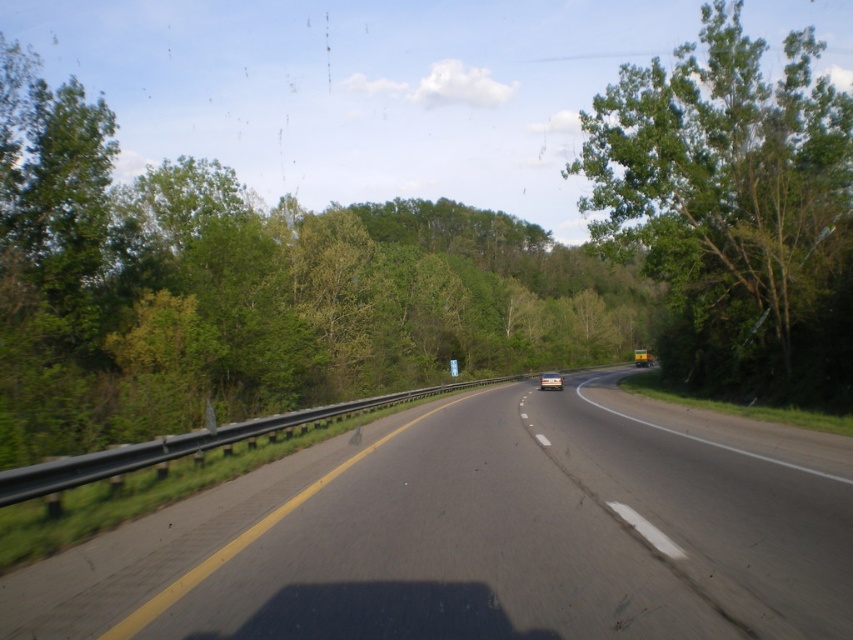
You are driving a car with a width of 2 meters. You see the green leafy tree at right. Can you safely drive through the road without hitting the tree?

The green leafy tree at right is located at point (733, 209). Since the tree is positioned at the right side of the road and the road has a width accommodating two lanes, the car can safely drive through the road without hitting the tree as long as it stays within its lane.

You are driving along the road and see a guardrail on your left. You notice a point marked at coordinates (733, 209). What object is located at that point?

The point at coordinates (733, 209) marks a green leafy tree at the right.